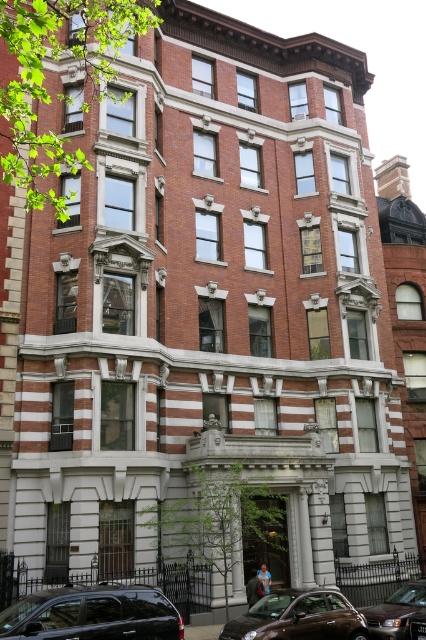
Which is more to the left, shiny brown car at lower center or shiny brown sedan at lower right?

Positioned to the left is shiny brown car at lower center.

Does shiny brown car at lower center have a lesser height compared to shiny brown sedan at lower right?

Yes, shiny brown car at lower center is shorter than shiny brown sedan at lower right.

Does point (321, 604) come in front of point (380, 628)?

Yes, it is in front of point (380, 628).

Where is `shiny brown car at lower center`? Image resolution: width=426 pixels, height=640 pixels. shiny brown car at lower center is located at coordinates (299, 618).

Which of these two, shiny black suv at lower left or shiny brown sedan at lower right, stands shorter?

Standing shorter between the two is shiny black suv at lower left.

Locate an element on the screen. shiny black suv at lower left is located at coordinates (92, 614).

The image size is (426, 640). What are the coordinates of `shiny black suv at lower left` in the screenshot? It's located at (92, 614).

Is shiny black suv at lower left to the right of shiny brown car at lower center from the viewer's perspective?

No, shiny black suv at lower left is not to the right of shiny brown car at lower center.

Who is positioned more to the right, shiny black suv at lower left or shiny brown car at lower center?

Positioned to the right is shiny brown car at lower center.

This screenshot has width=426, height=640. I want to click on shiny black suv at lower left, so click(x=92, y=614).